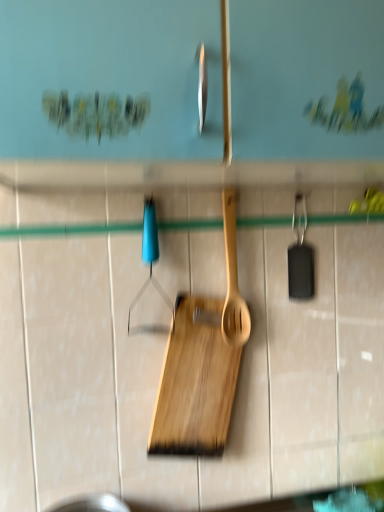
Question: From the image's perspective, is wooden spatula at center located above or below blue plastic hanger at center?

Choices:
 (A) above
 (B) below

Answer: (B)

Question: In the image, is wooden spatula at center positioned in front of or behind blue plastic hanger at center?

Choices:
 (A) front
 (B) behind

Answer: (B)

Question: Which object is positioned farthest from the wooden spatula at center?

Choices:
 (A) blue plastic hanger at center
 (B) natural wood cutting board at center

Answer: (A)

Question: Which of these objects is positioned closest to the wooden spatula at center?

Choices:
 (A) blue plastic hanger at center
 (B) natural wood cutting board at center

Answer: (B)